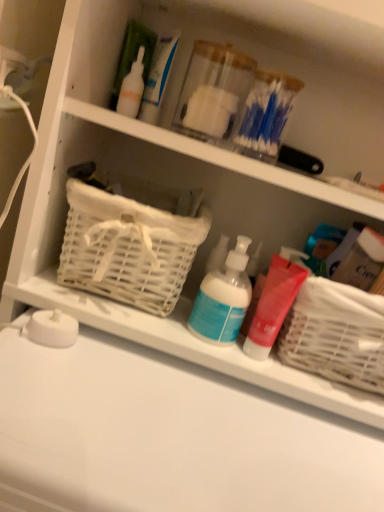
You are a GUI agent. You are given a task and a screenshot of the screen. Output one action in this format:
    pyautogui.click(x=<x>, y=<y>)
    Task: Click on the vacant space in front of blue matte pump bottle at center, marked as the first cleaning product in a left-to-right arrangement
    
    Given the screenshot: What is the action you would take?
    pyautogui.click(x=189, y=416)